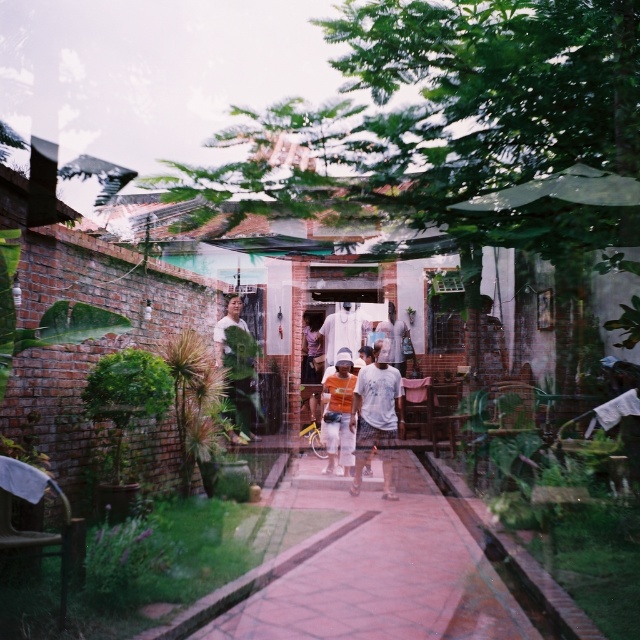
Question: Which is nearer to the orange cotton shirt at center?

Choices:
 (A) brick paved path at center
 (B) white fabric shirt at center
 (C) white cotton shirt at center
 (D) matte green shirt at center

Answer: (C)

Question: Which object is the closest to the matte green shirt at center?

Choices:
 (A) orange cotton shirt at center
 (B) brick paved path at center

Answer: (A)

Question: Which is nearer to the white cotton shirt at center?

Choices:
 (A) orange cotton shirt at center
 (B) brick paved path at center
 (C) matte green shirt at center
 (D) white fabric shirt at center

Answer: (A)

Question: Is white cotton shirt at center smaller than matte green shirt at center?

Choices:
 (A) no
 (B) yes

Answer: (B)

Question: Can you confirm if white cotton shirt at center is positioned to the right of white fabric shirt at center?

Choices:
 (A) no
 (B) yes

Answer: (B)

Question: Can you confirm if brick paved path at center is positioned above matte green shirt at center?

Choices:
 (A) no
 (B) yes

Answer: (A)